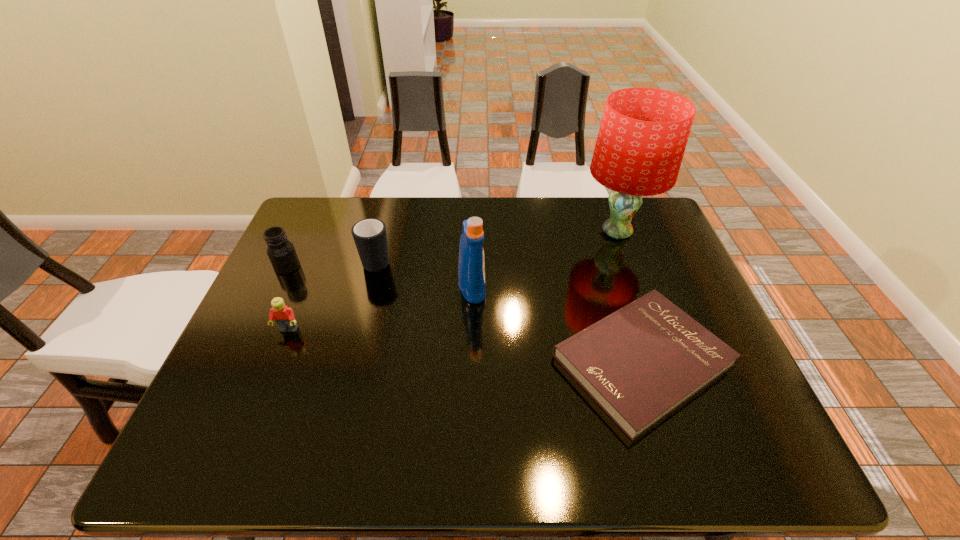
This screenshot has height=540, width=960. I want to click on free spot between the Lego and the shortest object, so click(x=466, y=345).

Where is `free space between the jar and the third object from left to right`? The height and width of the screenshot is (540, 960). free space between the jar and the third object from left to right is located at coordinates (332, 263).

Select which object is the fourth closest to the Lego. Please provide its 2D coordinates. Your answer should be formatted as a tuple, i.e. [(x, y)], where the tuple contains the x and y coordinates of a point satisfying the conditions above.

[(640, 363)]

Locate which object is the second closest to the fifth tallest object. Please provide its 2D coordinates. Your answer should be formatted as a tuple, i.e. [(x, y)], where the tuple contains the x and y coordinates of a point satisfying the conditions above.

[(370, 237)]

Where is `vacant space that satisfies the following two spatial constraints: 1. on the front side of the jar; 2. on the left side of the shortest object`? Image resolution: width=960 pixels, height=540 pixels. vacant space that satisfies the following two spatial constraints: 1. on the front side of the jar; 2. on the left side of the shortest object is located at coordinates (244, 360).

The height and width of the screenshot is (540, 960). In order to click on vacant space that satisfies the following two spatial constraints: 1. on the front-facing side of the lampshade; 2. on the face of the Lego in this screenshot , I will do `click(652, 330)`.

Identify the location of vacant space that satisfies the following two spatial constraints: 1. on the label of the shortest object; 2. on the left side of the third object from right to left. (470, 360).

Where is `vacant space that satisfies the following two spatial constraints: 1. on the front-facing side of the lampshade; 2. on the face of the Lego`? This screenshot has width=960, height=540. vacant space that satisfies the following two spatial constraints: 1. on the front-facing side of the lampshade; 2. on the face of the Lego is located at coordinates (652, 330).

Where is `vacant space that satisfies the following two spatial constraints: 1. on the label of the hardback book; 2. on the right side of the third object from right to left`? vacant space that satisfies the following two spatial constraints: 1. on the label of the hardback book; 2. on the right side of the third object from right to left is located at coordinates 470,360.

Locate an element on the screen. The height and width of the screenshot is (540, 960). vacant space that satisfies the following two spatial constraints: 1. on the label of the second tallest object; 2. on the face of the fifth tallest object is located at coordinates (471, 330).